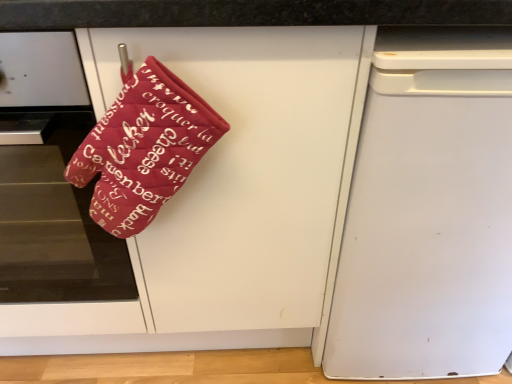
Question: Considering the relative positions of velvet red oven mitt at left and matte red oven mitt at upper left in the image provided, is velvet red oven mitt at left to the right of matte red oven mitt at upper left from the viewer's perspective?

Choices:
 (A) no
 (B) yes

Answer: (A)

Question: Does velvet red oven mitt at left appear on the left side of matte red oven mitt at upper left?

Choices:
 (A) no
 (B) yes

Answer: (B)

Question: Is velvet red oven mitt at left shorter than matte red oven mitt at upper left?

Choices:
 (A) no
 (B) yes

Answer: (B)

Question: Is velvet red oven mitt at left looking in the opposite direction of matte red oven mitt at upper left?

Choices:
 (A) no
 (B) yes

Answer: (B)

Question: Is velvet red oven mitt at left thinner than matte red oven mitt at upper left?

Choices:
 (A) yes
 (B) no

Answer: (A)

Question: Is matte red oven mitt at upper left taller or shorter than velvet red oven mitt at left?

Choices:
 (A) short
 (B) tall

Answer: (B)

Question: From the image's perspective, is matte red oven mitt at upper left positioned above or below velvet red oven mitt at left?

Choices:
 (A) above
 (B) below

Answer: (B)

Question: Considering the positions of point (284, 278) and point (19, 175), is point (284, 278) closer or farther from the camera than point (19, 175)?

Choices:
 (A) closer
 (B) farther

Answer: (A)

Question: In terms of width, does matte red oven mitt at upper left look wider or thinner when compared to velvet red oven mitt at left?

Choices:
 (A) wide
 (B) thin

Answer: (A)

Question: Relative to matte red oven mitt at upper left, is velvet red oven mitt at left in front or behind?

Choices:
 (A) front
 (B) behind

Answer: (B)

Question: Based on their sizes in the image, would you say velvet red oven mitt at left is bigger or smaller than matte red oven mitt at upper left?

Choices:
 (A) big
 (B) small

Answer: (B)

Question: In terms of width, does velvet red oven mitt at left look wider or thinner when compared to matte red oven mitt at upper left?

Choices:
 (A) thin
 (B) wide

Answer: (A)

Question: From the image's perspective, relative to matte red oven mitt at upper left, is velvet red oven mitt at left above or below?

Choices:
 (A) below
 (B) above

Answer: (B)

Question: Is white matte dishwasher at right bigger or smaller than matte red oven mitt at upper left?

Choices:
 (A) big
 (B) small

Answer: (B)

Question: From a real-world perspective, relative to matte red oven mitt at upper left, is white matte dishwasher at right vertically above or below?

Choices:
 (A) below
 (B) above

Answer: (A)